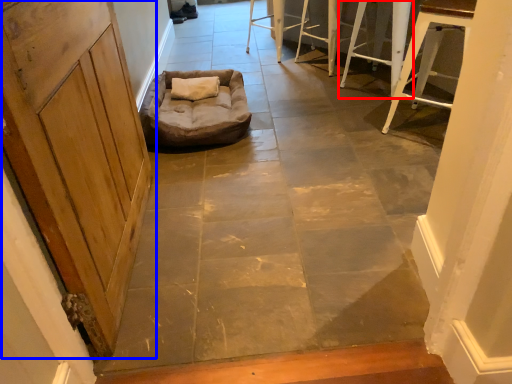
Question: Which of the following is the farthest to the observer, furniture (highlighted by a red box) or door (highlighted by a blue box)?

Choices:
 (A) furniture
 (B) door

Answer: (A)